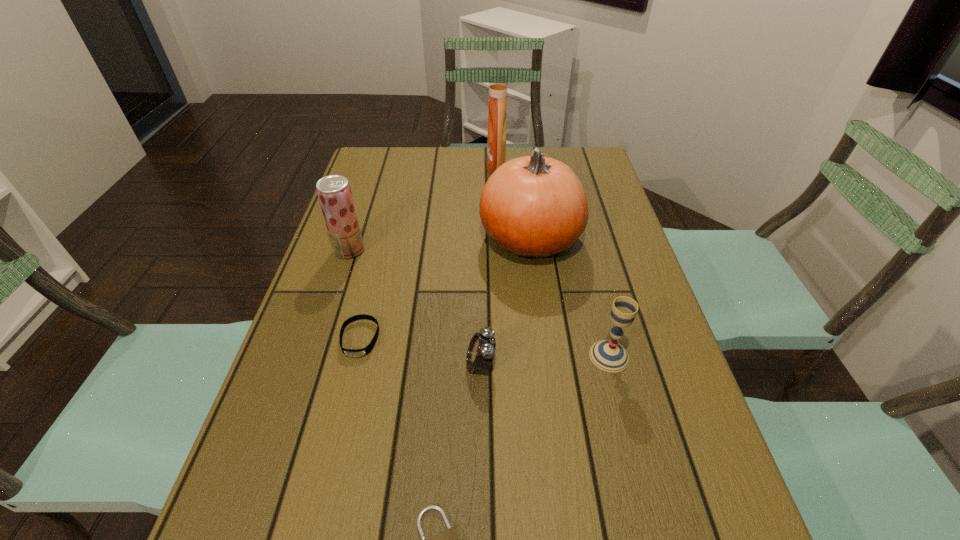
Find the location of a particular element. The width and height of the screenshot is (960, 540). the farthest object is located at coordinates (498, 85).

The width and height of the screenshot is (960, 540). Find the location of `pumpkin`. pumpkin is located at coordinates (533, 206).

Where is `the leftmost object`? The height and width of the screenshot is (540, 960). the leftmost object is located at coordinates (334, 193).

Image resolution: width=960 pixels, height=540 pixels. What are the coordinates of `fruit juice` in the screenshot? It's located at (334, 193).

Locate an element on the screen. The image size is (960, 540). the fourth shortest object is located at coordinates (608, 355).

The height and width of the screenshot is (540, 960). Identify the location of alarm clock. (481, 350).

At what (x,y) coordinates should I click in order to perform the action: click on wristband. Please return your answer as a coordinate pair (x, y). The image size is (960, 540). Looking at the image, I should click on (364, 351).

In order to click on the sixth object from right to left in this screenshot , I will do (364, 351).

At what (x,y) coordinates should I click in order to perform the action: click on vacant space located 0.280m on the front-facing side of the detergent. Please return your answer as a coordinate pair (x, y). The width and height of the screenshot is (960, 540). Looking at the image, I should click on (401, 168).

This screenshot has height=540, width=960. I want to click on free location located 0.070m on the front-facing side of the detergent, so click(466, 168).